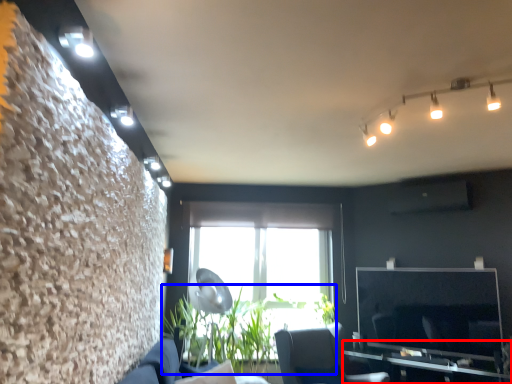
Question: Which of the following is the farthest to the observer, table (highlighted by a red box) or plant (highlighted by a blue box)?

Choices:
 (A) table
 (B) plant

Answer: (B)